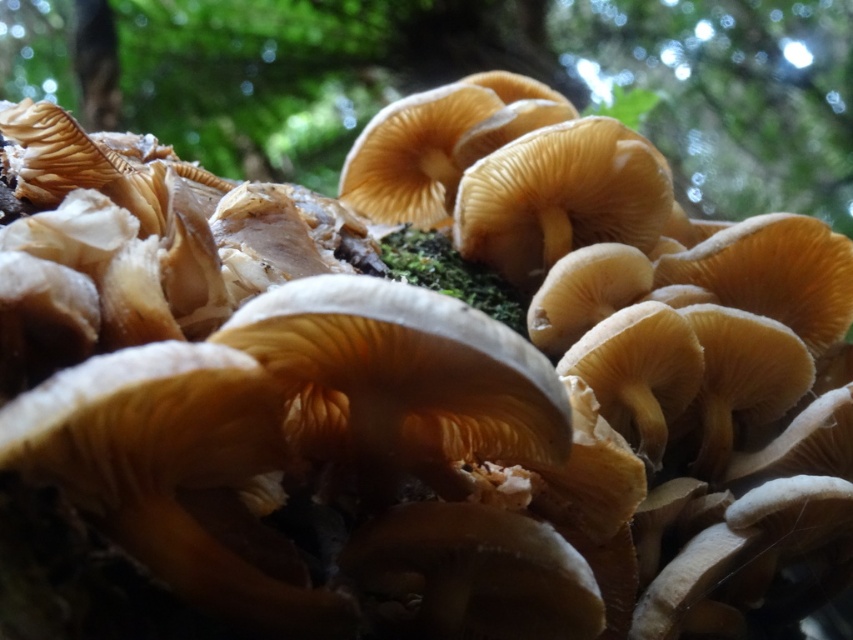
Does matte brown mushrooms at center have a greater width compared to brown rough tree trunk at upper left?

Indeed, matte brown mushrooms at center has a greater width compared to brown rough tree trunk at upper left.

Locate an element on the screen. Image resolution: width=853 pixels, height=640 pixels. matte brown mushrooms at center is located at coordinates (512, 70).

Who is more forward, [730,36] or [86,12]?

Result: Positioned in front is point [86,12].

I want to click on matte brown mushrooms at center, so click(512, 70).